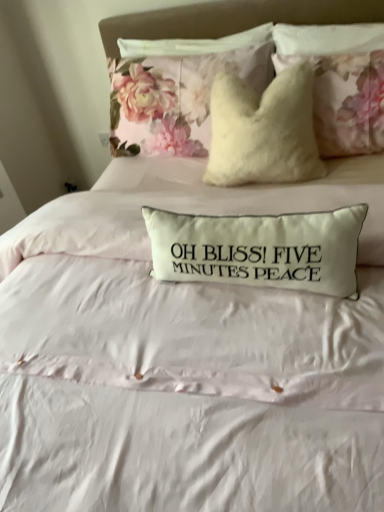
Question: Is floral fabric cushion at upper center, positioned as the first pillow in back-to-front order, inside the boundaries of white fabric pillow at center, acting as the 1th pillow starting from the bottom, or outside?

Choices:
 (A) outside
 (B) inside

Answer: (A)

Question: Is floral fabric cushion at upper center, the 2th pillow from the front, in front of or behind white fabric pillow at center, acting as the 1th pillow starting from the bottom, in the image?

Choices:
 (A) behind
 (B) front

Answer: (A)

Question: Which is farther from the white fabric pillow at center, the 1th pillow viewed from the front?

Choices:
 (A) fluffy white pillow at upper center
 (B) floral fabric cushion at upper center, the 2th pillow from the front

Answer: (A)

Question: Estimate the real-world distances between objects in this image. Which object is farther from the fluffy white pillow at upper center?

Choices:
 (A) floral fabric cushion at upper center, positioned as the first pillow in back-to-front order
 (B) white fabric pillow at center, the 1th pillow viewed from the front

Answer: (B)